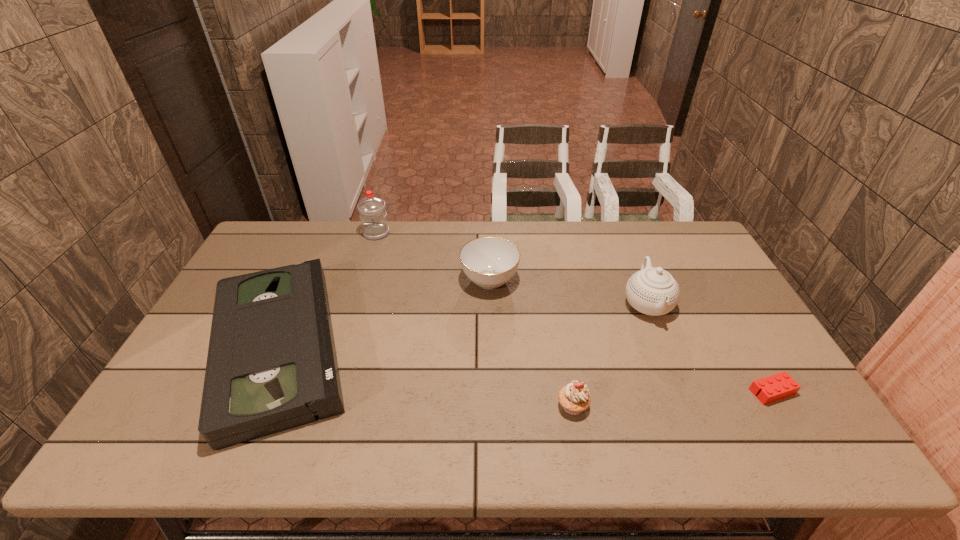
This screenshot has height=540, width=960. Find the location of `vacant space located 0.310m on the handle side of the farthest object`. vacant space located 0.310m on the handle side of the farthest object is located at coordinates (355, 301).

Where is `free spot located 0.210m on the spout of the fifth object from left to right`? free spot located 0.210m on the spout of the fifth object from left to right is located at coordinates (683, 393).

The image size is (960, 540). What are the coordinates of `free space located on the back of the shorter chinaware` in the screenshot? It's located at (489, 239).

Identify the location of vacant region located 0.210m on the back of the cupcake. The image size is (960, 540). (559, 330).

Identify the location of free space located 0.140m on the right of the videotape. The image size is (960, 540). (414, 347).

Locate an element on the screen. This screenshot has width=960, height=540. vacant space located 0.350m on the left of the Lego is located at coordinates (609, 392).

Locate an element on the screen. object present at the far edge is located at coordinates (372, 212).

I want to click on object positioned at the near edge, so click(271, 366).

The width and height of the screenshot is (960, 540). What are the coordinates of `object present at the left edge` in the screenshot? It's located at (271, 366).

You are a GUI agent. You are given a task and a screenshot of the screen. Output one action in this format:
    pyautogui.click(x=<x>, y=<y>)
    Task: Click on the object situated at the right edge
    The height and width of the screenshot is (540, 960).
    Given the screenshot: What is the action you would take?
    pyautogui.click(x=781, y=385)